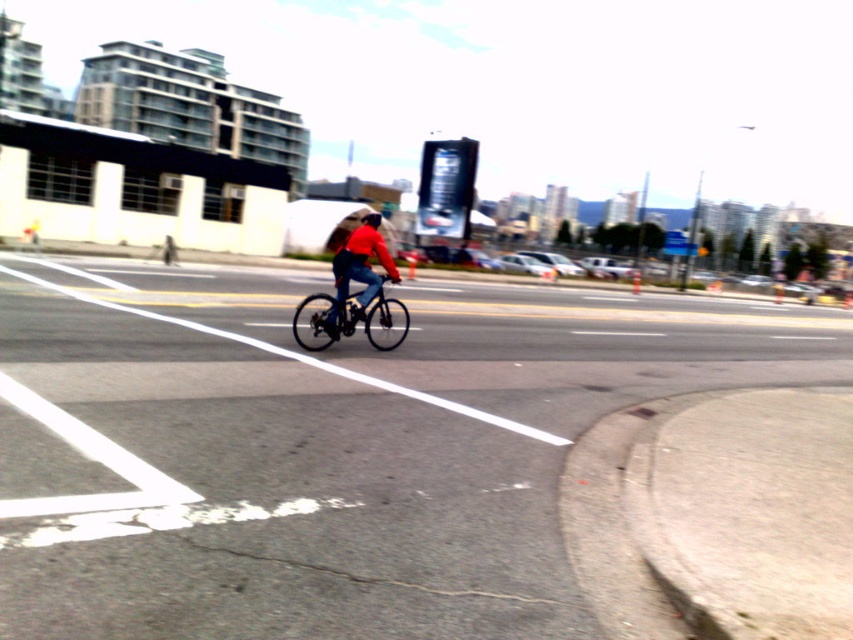
You are a pedestrian trying to cross the road and see the matte red jacket at center and the black matte bicycle helmet at center. Which object is closer to the right side of the road?

The matte red jacket at center is to the right of the black matte bicycle helmet at center, so the matte red jacket at center is closer to the right side of the road.

You are a delivery person who needs to place a small package on either the black rubber bike lane at center or the black matte bicycle helmet at center. Based on their sizes, which one can securely hold the package without it falling off?

The black rubber bike lane at center has a larger size compared to the black matte bicycle helmet at center, so the package can be placed on the black rubber bike lane at center to ensure it stays secure and doesn not fall off.

You are a pedestrian observing a cyclist in the city. You notice the matte red jacket at center and the black matte bicycle helmet at center. Which object is positioned higher from the ground?

The black matte bicycle helmet at center is positioned higher from the ground than the matte red jacket at center.